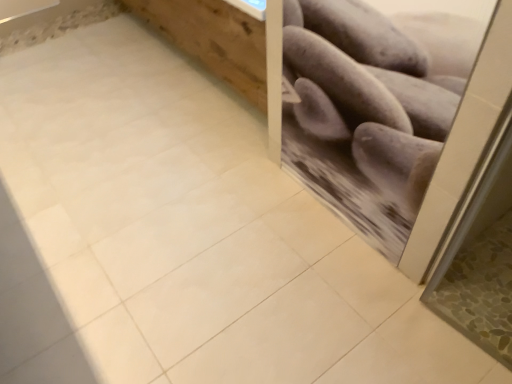
The image size is (512, 384). I want to click on gray matte potatoes at upper right, so click(378, 87).

This screenshot has height=384, width=512. What do you see at coordinates (378, 87) in the screenshot? I see `gray matte potatoes at upper right` at bounding box center [378, 87].

What is the approximate width of gray matte potatoes at upper right?

gray matte potatoes at upper right is 0.84 inches in width.

The image size is (512, 384). I want to click on gray matte potatoes at upper right, so click(x=378, y=87).